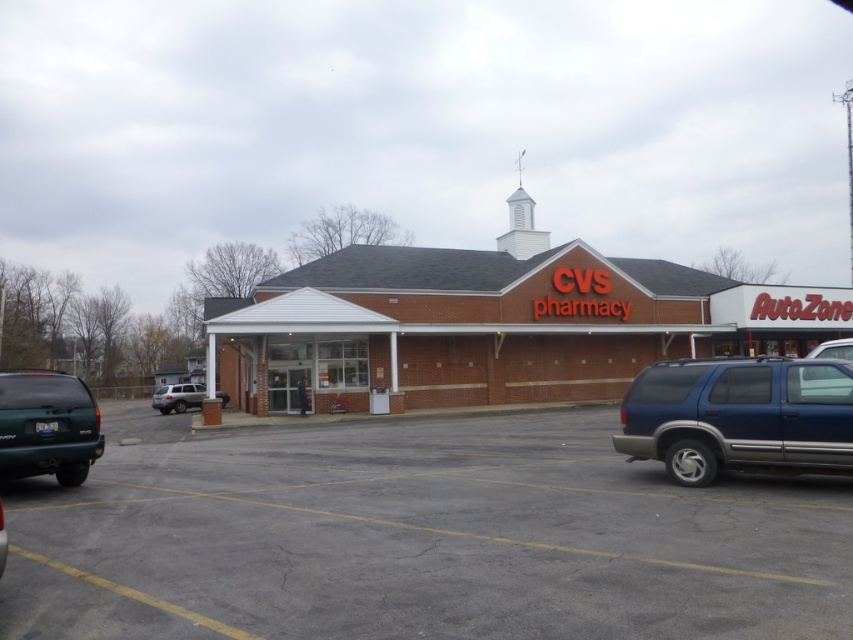
Question: Which point is closer to the camera?

Choices:
 (A) gray asphalt parking lot at center
 (B) green matte suv at lower left
 (C) satin silver suv at lower left
 (D) metallic blue suv at right

Answer: (A)

Question: Which of the following is the farthest from the observer?

Choices:
 (A) gray asphalt parking lot at center
 (B) metallic blue suv at right
 (C) green matte suv at lower left
 (D) satin silver suv at lower left

Answer: (D)

Question: Is gray asphalt parking lot at center closer to the viewer compared to green matte suv at lower left?

Choices:
 (A) yes
 (B) no

Answer: (A)

Question: Is metallic blue suv at right closer to the viewer compared to teal matte suv at lower left?

Choices:
 (A) no
 (B) yes

Answer: (B)

Question: Estimate the real-world distances between objects in this image. Which object is farther from the satin silver suv at lower left?

Choices:
 (A) green matte suv at lower left
 (B) gray asphalt parking lot at center

Answer: (A)

Question: Does gray asphalt parking lot at center appear on the left side of green matte suv at lower left?

Choices:
 (A) yes
 (B) no

Answer: (B)